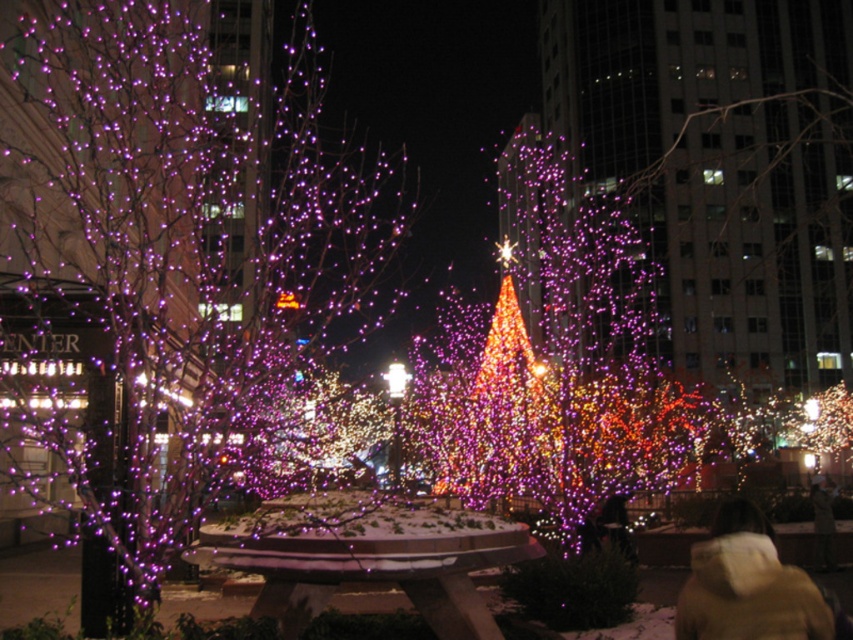
You are a photographer trying to capture the festive atmosphere of the city plaza. You have a camera with a wide angle lens that can capture objects up to 2 meters thick. You want to take a photo that includes both the tan quilted jacket at lower right and the illuminated glass christmas tree at center. Will both objects fit in the frame if you position yourself so that both are centered?

The tan quilted jacket at lower right is thinner than the illuminated glass christmas tree at center. Since the camera can capture objects up to 2 meters thick, and the thicker object is the illuminated glass christmas tree at center, which is within the camera lens capacity, both objects will fit in the frame.

You are a photographer standing in the city plaza. You want to capture a photo that includes both the tan quilted jacket at lower right and the illuminated glass christmas tree at center. Which object will appear larger in the photo?

The illuminated glass christmas tree at center will appear larger in the photo because it is bigger than the tan quilted jacket at lower right.

You are standing in the city plaza and want to take a photo of the purple glossy tree at center. Where should you position yourself to capture it in the frame?

You should position yourself at point (184, 241) to capture the purple glossy tree at center in the frame.